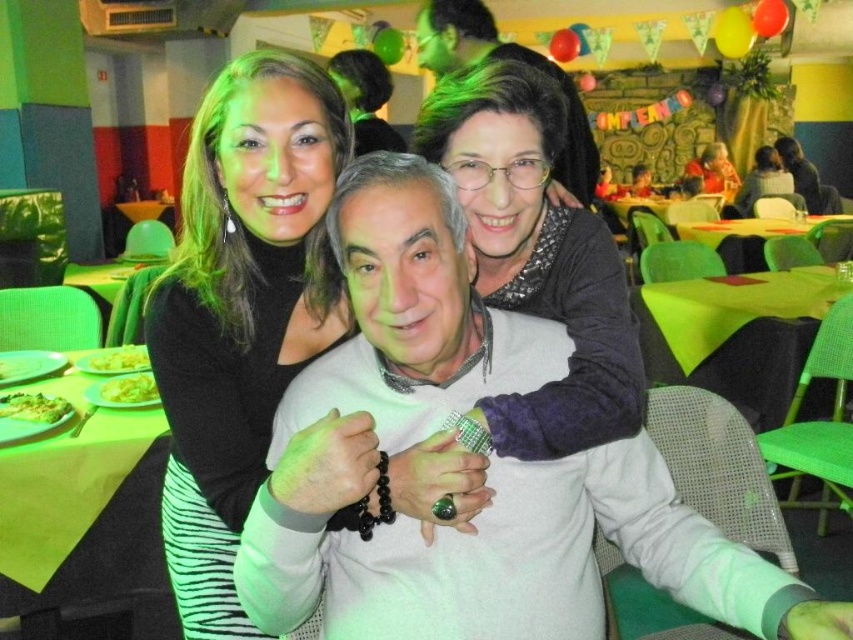
Question: Can you confirm if black matte dress at center is positioned above matte black sweater at upper center?

Choices:
 (A) yes
 (B) no

Answer: (B)

Question: Which of the following is the closest to the observer?

Choices:
 (A) (541, 570)
 (B) (790, 163)

Answer: (A)

Question: Is green matte pizza at lower left thinner than yellow matte pasta at left?

Choices:
 (A) no
 (B) yes

Answer: (A)

Question: Observing the image, what is the correct spatial positioning of matte black sweater at center in reference to green matte pizza at lower left?

Choices:
 (A) below
 (B) above

Answer: (A)

Question: Based on their relative distances, which object is farther from the matte black sweater at upper center?

Choices:
 (A) matte black dress at upper center
 (B) black matte dress at center

Answer: (B)

Question: Which object appears farthest from the camera in this image?

Choices:
 (A) yellow matte pasta at left
 (B) yellow matte pasta at center
 (C) black matte dress at center

Answer: (B)